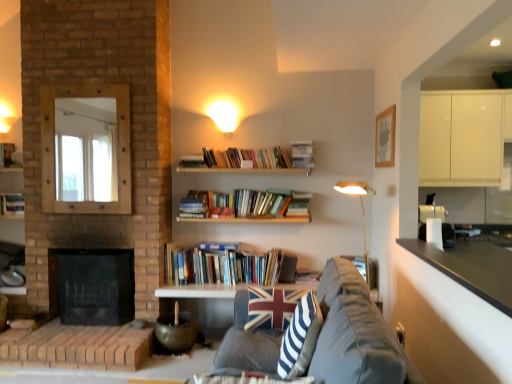
Describe the element at coordinates (77, 347) in the screenshot. The image size is (512, 384). I see `brown brick at lower left` at that location.

You are a GUI agent. You are given a task and a screenshot of the screen. Output one action in this format:
    pyautogui.click(x=<x>, y=<y>)
    Task: Click on the wooden mirror at left
    The height and width of the screenshot is (384, 512).
    Given the screenshot: What is the action you would take?
    pyautogui.click(x=116, y=148)

Measure the distance between hardcover book at center, arranged as the 4th book when viewed from the top, and camera.

3.81 meters.

Locate an element on the screen. white glossy cabinet at upper right is located at coordinates (463, 137).

Image resolution: width=512 pixels, height=384 pixels. What do you see at coordinates (224, 115) in the screenshot?
I see `matte white lampshade at upper center` at bounding box center [224, 115].

Find the location of a particular element. The height and width of the screenshot is (384, 512). brown brick at lower left is located at coordinates (77, 347).

Does brown brick at lower left touch dark gray fabric couch at center?

No, brown brick at lower left is not touching dark gray fabric couch at center.

Between brown brick at lower left and dark gray fabric couch at center, which one has smaller size?

brown brick at lower left is smaller.

Is the depth of brown brick at lower left less than that of dark gray fabric couch at center?

No, brown brick at lower left is further to the viewer.

Which object is closer to the camera taking this photo, wooden mirror at left or black granite countertop at lower right?

black granite countertop at lower right is in front.

From the image's perspective, is wooden mirror at left located above or below black granite countertop at lower right?

From the image's perspective, wooden mirror at left appears above black granite countertop at lower right.

Looking at the image, does wooden mirror at left seem bigger or smaller compared to black granite countertop at lower right?

Clearly, wooden mirror at left is larger in size than black granite countertop at lower right.

Based on the photo, how different are the orientations of wooden mirror at left and black granite countertop at lower right in degrees?

The angular difference between wooden mirror at left and black granite countertop at lower right is 89.5 degrees.

Considering the relative sizes of union jack fabric pillow at center and white glossy table at center in the image provided, is union jack fabric pillow at center shorter than white glossy table at center?

Incorrect, the height of union jack fabric pillow at center does not fall short of that of white glossy table at center.

Is white glossy table at center at the back of union jack fabric pillow at center?

Yes, union jack fabric pillow at center's orientation is away from white glossy table at center.

Based on the photo, considering the positions of objects union jack fabric pillow at center and white glossy table at center in the image provided, who is more to the left, union jack fabric pillow at center or white glossy table at center?

Positioned to the left is white glossy table at center.

Can you confirm if union jack fabric pillow at center is bigger than hardcover books at center, the 3th book when ordered from top to bottom?

Incorrect, union jack fabric pillow at center is not larger than hardcover books at center, the 3th book when ordered from top to bottom.

At what (x,y) coordinates should I click in order to perform the action: click on pillow on the right of hardcover books at center, which is the third book from right to left. Please return your answer as a coordinate pair (x, y). This screenshot has width=512, height=384. Looking at the image, I should click on (272, 306).

Relative to hardcover books at center, the 2th book when ordered from bottom to top, is union jack fabric pillow at center in front or behind?

union jack fabric pillow at center is positioned closer to the viewer than hardcover books at center, the 2th book when ordered from bottom to top.

Is union jack fabric pillow at center not close to hardcover books at center, the 3th book when ordered from top to bottom?

No, there isn't a large distance between union jack fabric pillow at center and hardcover books at center, the 3th book when ordered from top to bottom.

Is hardcover book at center, the 1th book positioned from the bottom, not near white glossy cabinet at upper right?

Yes, hardcover book at center, the 1th book positioned from the bottom, and white glossy cabinet at upper right are quite far apart.

From a real-world perspective, is hardcover book at center, which is counted as the fourth book, starting from the left, below white glossy cabinet at upper right?

Yes, from a real-world perspective, hardcover book at center, which is counted as the fourth book, starting from the left, is under white glossy cabinet at upper right.

Is white glossy cabinet at upper right completely or partially inside hardcover book at center, the first book viewed from the right?

Actually, white glossy cabinet at upper right is outside hardcover book at center, the first book viewed from the right.

Does brick fireplace at left have a greater height compared to white paper at upper center, the 2th book when ordered from right to left?

Yes, brick fireplace at left is taller than white paper at upper center, the 2th book when ordered from right to left.

Is white paper at upper center, which is the third book in left-to-right order, at the back of brick fireplace at left?

No, brick fireplace at left is not facing the opposite direction of white paper at upper center, which is the third book in left-to-right order.

Is brick fireplace at left to the right of white paper at upper center, which is the third book in left-to-right order, from the viewer's perspective?

In fact, brick fireplace at left is to the left of white paper at upper center, which is the third book in left-to-right order.

You are a GUI agent. You are given a task and a screenshot of the screen. Output one action in this format:
    pyautogui.click(x=<x>, y=<y>)
    Task: Click on the book that is the 4th object above the brick fireplace at left (from a real-world perspective)
    The height and width of the screenshot is (384, 512).
    Given the screenshot: What is the action you would take?
    pyautogui.click(x=302, y=154)

Is blue and white striped fabric pillow at center wider than brick fireplace at left?

Incorrect, the width of blue and white striped fabric pillow at center does not surpass that of brick fireplace at left.

The width and height of the screenshot is (512, 384). Identify the location of throw pillow that is above the brick fireplace at left (from the image's perspective). (300, 338).

From a real-world perspective, is blue and white striped fabric pillow at center on top of brick fireplace at left?

Indeed, from a real-world perspective, blue and white striped fabric pillow at center stands above brick fireplace at left.

Locate an element on the screen. The height and width of the screenshot is (384, 512). studio couch lying on the right of brown brick at lower left is located at coordinates (355, 334).

This screenshot has width=512, height=384. In order to click on counter top lying in front of the wooden mirror at left in this screenshot , I will do coord(472,268).

From the image, which object appears to be farther from black granite countertop at lower right, wooden picture frame at upper right or white glossy table at center?

Among the two, white glossy table at center is located further to black granite countertop at lower right.

When comparing their distances from white paper at upper center, the 2th book when ordered from right to left, does hardcover books at center, which appears as the second book when viewed from the left, or union jack fabric pillow at center seem closer?

The object closer to white paper at upper center, the 2th book when ordered from right to left, is hardcover books at center, which appears as the second book when viewed from the left.

From the image, which object appears to be farther from white glossy cabinet at upper right, wooden picture frame at upper right or wooden mirror at left?

The object further to white glossy cabinet at upper right is wooden mirror at left.

Estimate the real-world distances between objects in this image. Which object is closer to brown brick at lower left, wooden picture frame at upper right or union jack fabric pillow at center?

The object closer to brown brick at lower left is union jack fabric pillow at center.

Estimate the real-world distances between objects in this image. Which object is closer to white glossy cabinet at upper right, white glossy table at center or hardcover books at center, which appears as the second book when viewed from the left?

Among the two, hardcover books at center, which appears as the second book when viewed from the left, is located nearer to white glossy cabinet at upper right.

When comparing their distances from union jack fabric pillow at center, does brick fireplace at left or white glossy cabinet at upper right seem closer?

Among the two, brick fireplace at left is located nearer to union jack fabric pillow at center.

Estimate the real-world distances between objects in this image. Which object is further from brown brick at lower left, wooden picture frame at upper right or wooden mirror at left?

wooden picture frame at upper right is positioned further to the anchor brown brick at lower left.

Based on their spatial positions, is hardcover book at center, the 1th book positioned from the bottom, or brown brick at lower left closer to dark gray fabric couch at center?

hardcover book at center, the 1th book positioned from the bottom.

Where is `fireplace that lies between matte white lampshade at upper center and brown brick at lower left from top to bottom`? Image resolution: width=512 pixels, height=384 pixels. fireplace that lies between matte white lampshade at upper center and brown brick at lower left from top to bottom is located at coordinates (93, 285).

Where is `table located between hardcover book at left, the 1th book from the left, and wooden picture frame at upper right in the left-right direction`? Image resolution: width=512 pixels, height=384 pixels. table located between hardcover book at left, the 1th book from the left, and wooden picture frame at upper right in the left-right direction is located at coordinates (200, 291).

Locate an element on the screen. The height and width of the screenshot is (384, 512). table between blue and white striped fabric pillow at center and white paper at upper center, the 2th book when ordered from right to left, along the z-axis is located at coordinates 200,291.

This screenshot has height=384, width=512. Identify the location of pillow located between blue and white striped fabric pillow at center and hardcover books at center, the 2th book when ordered from bottom to top, in the depth direction. (272, 306).